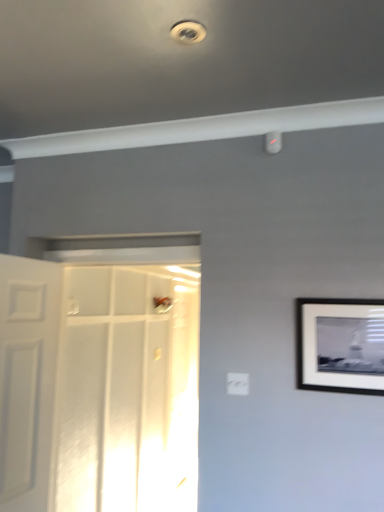
Question: From a real-world perspective, relative to white plastic electric outlet at center, is white plastic droplight at upper center, which is counted as the first droplight, starting from the top, vertically above or below?

Choices:
 (A) below
 (B) above

Answer: (B)

Question: Which is correct: white plastic droplight at upper center, which is counted as the first droplight, starting from the top, is inside white plastic electric outlet at center, or outside of it?

Choices:
 (A) outside
 (B) inside

Answer: (A)

Question: Which is nearer to the white plastic droplight at upper center, arranged as the first droplight when viewed from the front?

Choices:
 (A) black matte picture frame at right
 (B) white glossy door at center, the second door positioned from the left
 (C) white plastic electric outlet at center
 (D) white plastic droplight at upper right, placed as the 1th droplight when sorted from back to front
 (E) white matte door at left, the first door viewed from the left

Answer: (D)

Question: Which object is positioned closest to the white plastic electric outlet at center?

Choices:
 (A) white plastic droplight at upper right, placed as the 1th droplight when sorted from back to front
 (B) white plastic droplight at upper center, which is counted as the first droplight, starting from the top
 (C) white glossy door at center, the second door positioned from the left
 (D) white matte door at left, the first door viewed from the left
 (E) black matte picture frame at right

Answer: (E)